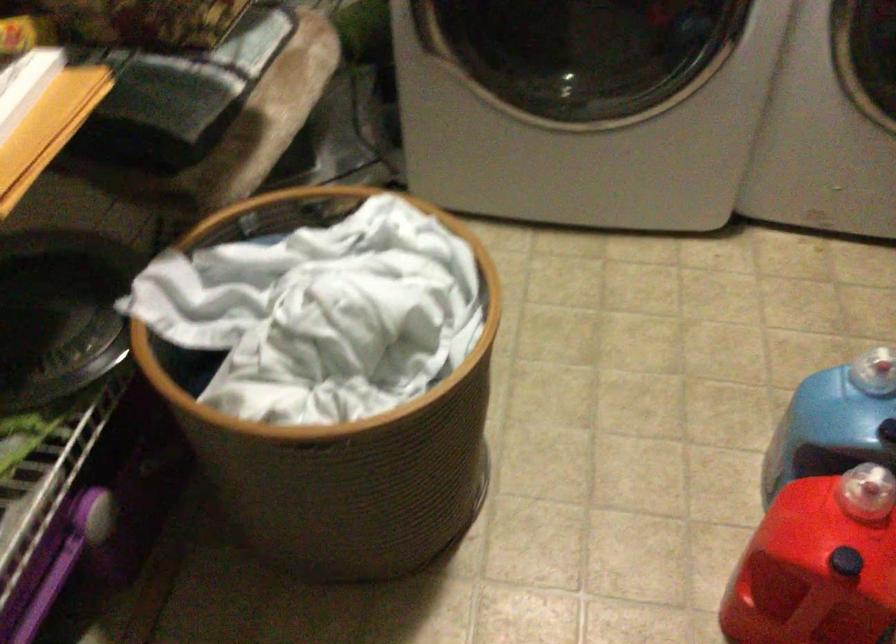
Find where to lift the laundry basket. Please return your answer as a coordinate pair (x, y).

(341, 451)